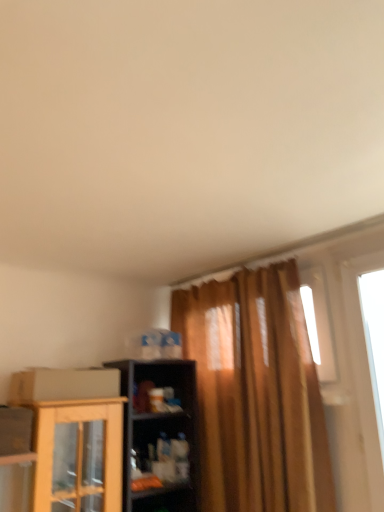
Question: Does cardboard box at lower left touch matte plastic shelf at center?

Choices:
 (A) no
 (B) yes

Answer: (A)

Question: Is matte plastic shelf at center located within cardboard box at lower left?

Choices:
 (A) yes
 (B) no

Answer: (B)

Question: Considering the relative sizes of cardboard box at lower left and matte plastic shelf at center in the image provided, is cardboard box at lower left taller than matte plastic shelf at center?

Choices:
 (A) yes
 (B) no

Answer: (B)

Question: Considering the relative positions of cardboard box at lower left and matte plastic shelf at center in the image provided, is cardboard box at lower left to the right of matte plastic shelf at center from the viewer's perspective?

Choices:
 (A) no
 (B) yes

Answer: (A)

Question: Does cardboard box at lower left have a lesser height compared to matte plastic shelf at center?

Choices:
 (A) yes
 (B) no

Answer: (A)

Question: From a real-world perspective, is transparent glass window at right positioned above or below cardboard box at lower left?

Choices:
 (A) above
 (B) below

Answer: (A)

Question: Is transparent glass window at right taller or shorter than cardboard box at lower left?

Choices:
 (A) short
 (B) tall

Answer: (B)

Question: Looking at the image, does transparent glass window at right seem bigger or smaller compared to cardboard box at lower left?

Choices:
 (A) big
 (B) small

Answer: (B)

Question: Looking at their shapes, would you say transparent glass window at right is wider or thinner than cardboard box at lower left?

Choices:
 (A) wide
 (B) thin

Answer: (B)

Question: Considering their positions, is matte plastic shelf at center located in front of or behind transparent glass window at right?

Choices:
 (A) front
 (B) behind

Answer: (B)

Question: From their relative heights in the image, would you say matte plastic shelf at center is taller or shorter than transparent glass window at right?

Choices:
 (A) short
 (B) tall

Answer: (A)

Question: In the image, is matte plastic shelf at center on the left side or the right side of transparent glass window at right?

Choices:
 (A) left
 (B) right

Answer: (A)

Question: Is matte plastic shelf at center inside the boundaries of transparent glass window at right, or outside?

Choices:
 (A) outside
 (B) inside

Answer: (A)

Question: From a real-world perspective, relative to cardboard box at lower left, is matte plastic shelf at center vertically above or below?

Choices:
 (A) above
 (B) below

Answer: (B)

Question: Would you say matte plastic shelf at center is inside or outside cardboard box at lower left?

Choices:
 (A) outside
 (B) inside

Answer: (A)